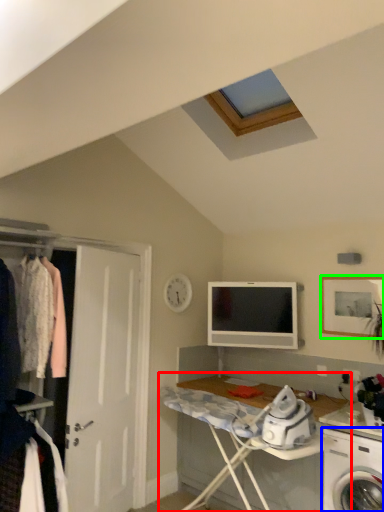
Question: Which object is positioned closest to desk (highlighted by a red box)? Select from washing machine (highlighted by a blue box) and picture frame (highlighted by a green box).

Choices:
 (A) washing machine
 (B) picture frame

Answer: (A)